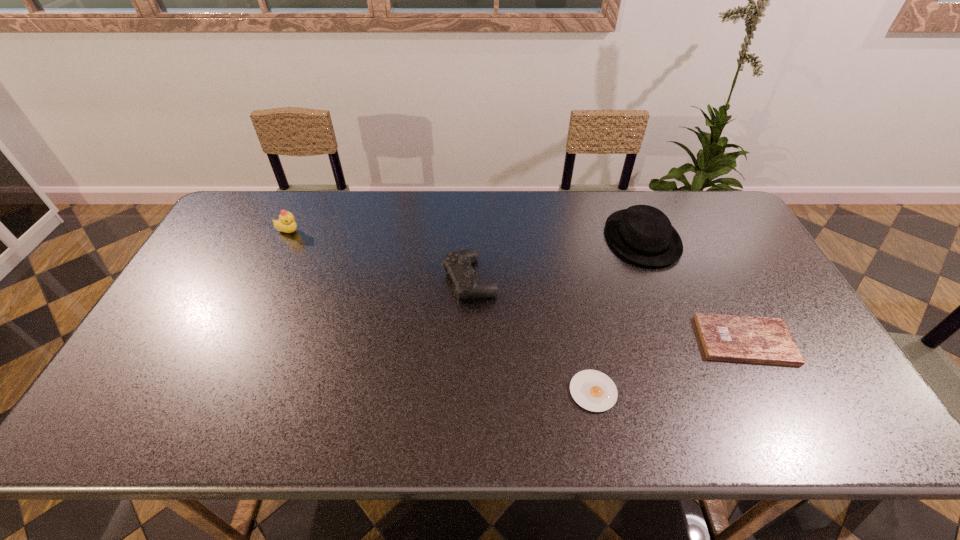
Locate an element on the screen. Image resolution: width=960 pixels, height=540 pixels. free region located on the right of the third tallest object is located at coordinates (526, 279).

The height and width of the screenshot is (540, 960). Find the location of `vacant area situated on the left of the second shortest object`. vacant area situated on the left of the second shortest object is located at coordinates (618, 340).

The image size is (960, 540). In order to click on blank space located on the right of the egg yolk in this screenshot , I will do `click(692, 392)`.

Where is `duckling at the far edge`? This screenshot has height=540, width=960. duckling at the far edge is located at coordinates (286, 223).

At what (x,y) coordinates should I click in order to perform the action: click on fedora that is positioned at the far edge. Please return your answer as a coordinate pair (x, y). Image resolution: width=960 pixels, height=540 pixels. Looking at the image, I should click on (643, 234).

In order to click on object at the near edge in this screenshot , I will do point(593,390).

Where is `object positioned at the right edge`? object positioned at the right edge is located at coordinates (764, 340).

This screenshot has height=540, width=960. Identify the location of vacant space at the far edge of the desktop. (333, 200).

Find the location of a particular element. free space at the near edge is located at coordinates (740, 434).

The image size is (960, 540). In the image, there is a desktop. In order to click on vacant area at the left edge in this screenshot , I will do tap(182, 316).